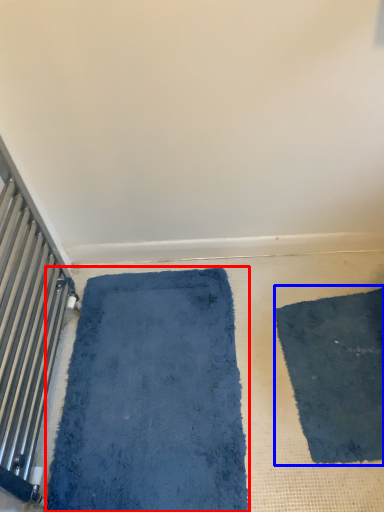
Question: Which of the following is the closest to the observer, bath mat (highlighted by a red box) or mat (highlighted by a blue box)?

Choices:
 (A) bath mat
 (B) mat

Answer: (A)